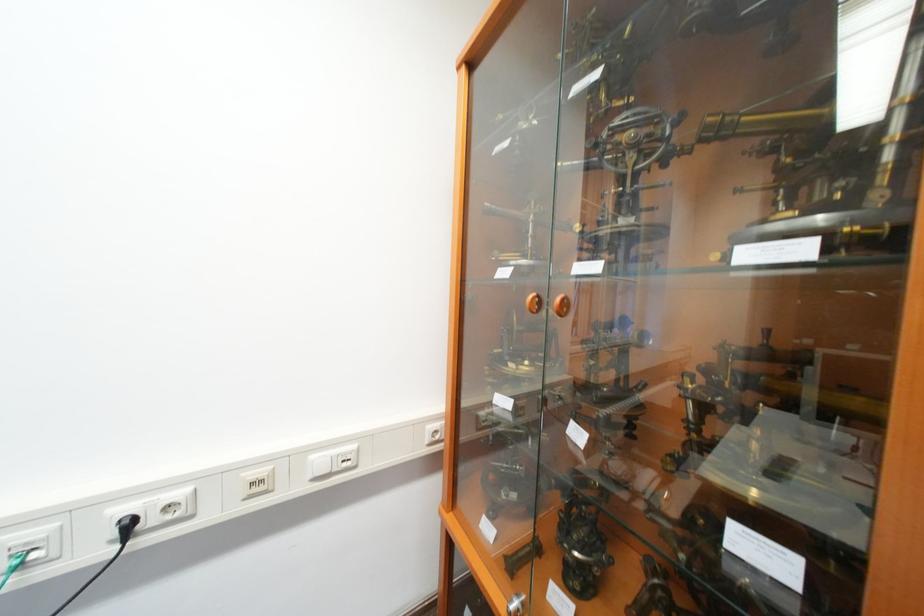
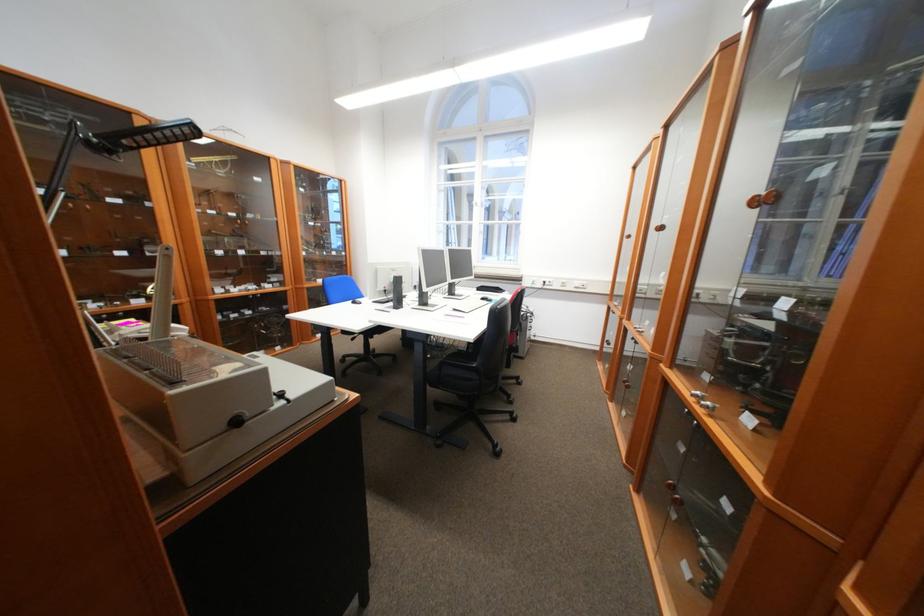
The point at (200, 517) is marked in the first image. Where is the corresponding point in the second image?

(562, 286)